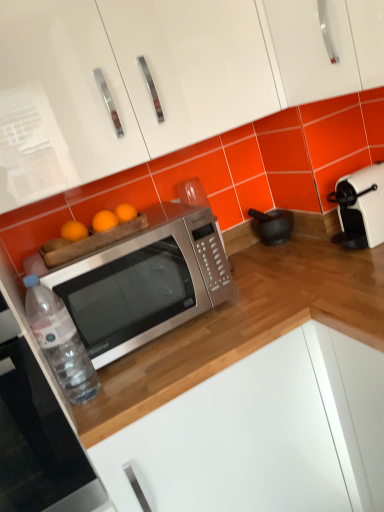
The width and height of the screenshot is (384, 512). Find the location of `vacant area located to the right-hand side of clear plastic bottle at lower left`. vacant area located to the right-hand side of clear plastic bottle at lower left is located at coordinates (138, 368).